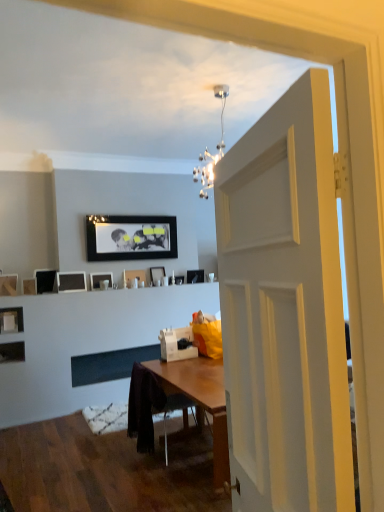
Describe the element at coordinates (71, 281) in the screenshot. I see `matte black picture frame at center, placed as the seventh picture frame when sorted from right to left` at that location.

What do you see at coordinates (134, 276) in the screenshot?
I see `matte black picture frame at upper center, placed as the fourth picture frame when sorted from right to left` at bounding box center [134, 276].

Identify the location of matte black picture frame at upper center, placed as the fourth picture frame when sorted from right to left. This screenshot has height=512, width=384. (134, 276).

The image size is (384, 512). What do you see at coordinates (100, 280) in the screenshot?
I see `matte black picture frame at upper center, the sixth picture frame positioned from the left` at bounding box center [100, 280].

How much space does matte black picture frame at upper center, placed as the eleventh picture frame when sorted from left to right, occupy horizontally?

matte black picture frame at upper center, placed as the eleventh picture frame when sorted from left to right, is 6.08 inches wide.

Where is `matte black picture frame at center, the tenth picture frame viewed from the left`? This screenshot has width=384, height=512. matte black picture frame at center, the tenth picture frame viewed from the left is located at coordinates (179, 279).

You are a GUI agent. You are given a task and a screenshot of the screen. Output one action in this format:
    pyautogui.click(x=<x>, y=<y>)
    Task: Click on the matte black picture frame at left, which is the 1th picture frame in left-to-right order
    
    Given the screenshot: What is the action you would take?
    pyautogui.click(x=8, y=285)

Does black glossy picture frame at upper center, which ranks as the 7th picture frame in left-to-right order, have a greater width compared to matte black picture frame at upper center, the sixth picture frame positioned from the left?

No, black glossy picture frame at upper center, which ranks as the 7th picture frame in left-to-right order, is not wider than matte black picture frame at upper center, the sixth picture frame positioned from the left.

How much distance is there between black glossy picture frame at upper center, which ranks as the 7th picture frame in left-to-right order, and matte black picture frame at upper center, the sixth picture frame positioned from the left?

black glossy picture frame at upper center, which ranks as the 7th picture frame in left-to-right order, and matte black picture frame at upper center, the sixth picture frame positioned from the left, are 27.09 inches apart from each other.

Is point (108, 238) more distant than point (111, 283)?

Yes, it is behind point (111, 283).

The image size is (384, 512). There is a matte black picture frame at upper center, marked as the 6th picture frame in a right-to-left arrangement. Identify the location of the 6th picture frame above it (from a real-world perspective). (130, 237).

Who is shorter, matte black picture frame at left, arranged as the fourth picture frame when viewed from the left, or matte black picture frame at left, acting as the tenth picture frame starting from the right?

matte black picture frame at left, acting as the tenth picture frame starting from the right.

Is point (37, 287) positioned behind point (20, 319)?

Yes, it is.

Is matte black picture frame at left, arranged as the fourth picture frame when viewed from the left, directly adjacent to matte black picture frame at left, acting as the tenth picture frame starting from the right?

No.

Which of these two, wooden chair at center or wooden picture frame at left, the 3th picture frame in the left-to-right sequence, is bigger?

Bigger between the two is wooden chair at center.

Can you confirm if wooden chair at center is positioned to the left of wooden picture frame at left, which is counted as the 9th picture frame, starting from the right?

Incorrect, wooden chair at center is not on the left side of wooden picture frame at left, which is counted as the 9th picture frame, starting from the right.

Is there a large distance between wooden chair at center and wooden picture frame at left, the 3th picture frame in the left-to-right sequence?

wooden chair at center is positioned a significant distance from wooden picture frame at left, the 3th picture frame in the left-to-right sequence.

From the image's perspective, which object appears higher, wooden chair at center or wooden picture frame at left, the 3th picture frame in the left-to-right sequence?

wooden picture frame at left, the 3th picture frame in the left-to-right sequence.

Considering the relative sizes of matte black picture frame at upper center, marked as the 6th picture frame in a right-to-left arrangement, and matte black picture frame at center, the 5th picture frame from the left, in the image provided, is matte black picture frame at upper center, marked as the 6th picture frame in a right-to-left arrangement, shorter than matte black picture frame at center, the 5th picture frame from the left,?

Indeed, matte black picture frame at upper center, marked as the 6th picture frame in a right-to-left arrangement, has a lesser height compared to matte black picture frame at center, the 5th picture frame from the left.

Is matte black picture frame at upper center, marked as the 6th picture frame in a right-to-left arrangement, thinner than matte black picture frame at center, placed as the seventh picture frame when sorted from right to left?

Correct, the width of matte black picture frame at upper center, marked as the 6th picture frame in a right-to-left arrangement, is less than that of matte black picture frame at center, placed as the seventh picture frame when sorted from right to left.

Which is behind, matte black picture frame at upper center, the sixth picture frame positioned from the left, or matte black picture frame at center, the 5th picture frame from the left?

matte black picture frame at upper center, the sixth picture frame positioned from the left, is further from the camera.

Looking at this image, is matte black picture frame at upper center, the sixth picture frame positioned from the left, oriented away from matte black picture frame at center, the 5th picture frame from the left?

No, matte black picture frame at upper center, the sixth picture frame positioned from the left,'s orientation is not away from matte black picture frame at center, the 5th picture frame from the left.

Is matte black picture frame at center, placed as the seventh picture frame when sorted from right to left, oriented towards matte black picture frame at left, acting as the tenth picture frame starting from the right?

No, matte black picture frame at center, placed as the seventh picture frame when sorted from right to left, does not turn towards matte black picture frame at left, acting as the tenth picture frame starting from the right.

Between matte black picture frame at center, placed as the seventh picture frame when sorted from right to left, and matte black picture frame at left, acting as the tenth picture frame starting from the right, which one has less height?

With less height is matte black picture frame at left, acting as the tenth picture frame starting from the right.

Is matte black picture frame at center, the 5th picture frame from the left, spatially inside matte black picture frame at left, which is the second picture frame in left-to-right order, or outside of it?

matte black picture frame at center, the 5th picture frame from the left, is not enclosed by matte black picture frame at left, which is the second picture frame in left-to-right order.

In the image, is matte black picture frame at center, the 5th picture frame from the left, on the left side or the right side of matte black picture frame at left, which is the second picture frame in left-to-right order?

In the image, matte black picture frame at center, the 5th picture frame from the left, appears on the right side of matte black picture frame at left, which is the second picture frame in left-to-right order.

Is matte black picture frame at center, placed as the seventh picture frame when sorted from right to left, positioned before wooden chair at center?

No, the depth of matte black picture frame at center, placed as the seventh picture frame when sorted from right to left, is greater than that of wooden chair at center.

Which point is more forward, [85,285] or [141,403]?

The point [141,403] is closer to the camera.

Does matte black picture frame at center, the 5th picture frame from the left, appear on the left side of wooden chair at center?

Indeed, matte black picture frame at center, the 5th picture frame from the left, is positioned on the left side of wooden chair at center.

Is matte black picture frame at upper center, placed as the fourth picture frame when sorted from right to left, in front of or behind matte black picture frame at center, the 9th picture frame from the left, in the image?

matte black picture frame at upper center, placed as the fourth picture frame when sorted from right to left, is in front of matte black picture frame at center, the 9th picture frame from the left.

Considering the sizes of matte black picture frame at upper center, the 8th picture frame when ordered from left to right, and matte black picture frame at center, the 3th picture frame from the right, in the image, is matte black picture frame at upper center, the 8th picture frame when ordered from left to right, taller or shorter than matte black picture frame at center, the 3th picture frame from the right,?

Clearly, matte black picture frame at upper center, the 8th picture frame when ordered from left to right, is shorter compared to matte black picture frame at center, the 3th picture frame from the right.

Would you say matte black picture frame at upper center, the 8th picture frame when ordered from left to right, is outside matte black picture frame at center, the 3th picture frame from the right?

matte black picture frame at upper center, the 8th picture frame when ordered from left to right, is positioned outside matte black picture frame at center, the 3th picture frame from the right.

Between point (139, 279) and point (159, 278), which one is positioned behind?

Positioned behind is point (159, 278).

From the image's perspective, which picture frame is the 6th one below the black glossy picture frame at upper center, arranged as the fifth picture frame when viewed from the right? Please provide its 2D coordinates.

[(100, 280)]

There is a matte black picture frame at left, arranged as the fourth picture frame when viewed from the left. Where is `the 9th picture frame below it (from a real-world perspective)`? the 9th picture frame below it (from a real-world perspective) is located at coordinates (11, 320).

Based on their spatial positions, is matte black picture frame at center, the 3th picture frame from the right, or wooden chair at center closer to matte black picture frame at left, arranged as the fourth picture frame when viewed from the left?

Based on the image, matte black picture frame at center, the 3th picture frame from the right, appears to be nearer to matte black picture frame at left, arranged as the fourth picture frame when viewed from the left.

Based on their spatial positions, is matte black picture frame at center, the 3th picture frame from the right, or matte black picture frame at upper center, the sixth picture frame positioned from the left, further from black glossy picture frame at upper center, which ranks as the 7th picture frame in left-to-right order?

The object further to black glossy picture frame at upper center, which ranks as the 7th picture frame in left-to-right order, is matte black picture frame at upper center, the sixth picture frame positioned from the left.

Which object lies further to the anchor point wooden picture frame at left, which is counted as the 9th picture frame, starting from the right, matte black picture frame at upper center, the 8th picture frame when ordered from left to right, or matte black picture frame at left, acting as the tenth picture frame starting from the right?

matte black picture frame at upper center, the 8th picture frame when ordered from left to right, is positioned further to the anchor wooden picture frame at left, which is counted as the 9th picture frame, starting from the right.

When comparing their distances from matte black picture frame at upper center, placed as the eleventh picture frame when sorted from left to right, does wooden picture frame at left, which is counted as the 9th picture frame, starting from the right, or matte black picture frame at left, arranged as the fourth picture frame when viewed from the left, seem closer?

Based on the image, matte black picture frame at left, arranged as the fourth picture frame when viewed from the left, appears to be nearer to matte black picture frame at upper center, placed as the eleventh picture frame when sorted from left to right.

Based on their spatial positions, is black glossy picture frame at upper center, arranged as the fifth picture frame when viewed from the right, or matte black picture frame at left, arranged as the fourth picture frame when viewed from the left, further from matte black picture frame at center, the 3th picture frame from the right?

matte black picture frame at left, arranged as the fourth picture frame when viewed from the left.

Looking at this image, based on their spatial positions, is wooden chair at center or black glossy picture frame at upper center, arranged as the fifth picture frame when viewed from the right, further from matte black picture frame at center, the 9th picture frame from the left?

Among the two, wooden chair at center is located further to matte black picture frame at center, the 9th picture frame from the left.

Which object lies nearer to the anchor point matte black picture frame at center, which is the second picture frame in right-to-left order, wooden chair at center or matte black picture frame at center, placed as the seventh picture frame when sorted from right to left?

The object closer to matte black picture frame at center, which is the second picture frame in right-to-left order, is matte black picture frame at center, placed as the seventh picture frame when sorted from right to left.

From the image, which object appears to be farther from matte black picture frame at left, marked as the 8th picture frame in a right-to-left arrangement, matte black picture frame at center, the 9th picture frame from the left, or matte black picture frame at upper center, placed as the fourth picture frame when sorted from right to left?

Among the two, matte black picture frame at center, the 9th picture frame from the left, is located further to matte black picture frame at left, marked as the 8th picture frame in a right-to-left arrangement.

This screenshot has width=384, height=512. Identify the location of chair situated between matte black picture frame at left, which ranks as the eleventh picture frame in right-to-left order, and matte black picture frame at upper center, which is counted as the first picture frame, starting from the right, from left to right. (150, 407).

I want to click on picture frame between matte black picture frame at left, arranged as the fourth picture frame when viewed from the left, and matte black picture frame at upper center, marked as the 6th picture frame in a right-to-left arrangement, from left to right, so click(x=71, y=281).

Where is `picture frame situated between wooden picture frame at left, the 3th picture frame in the left-to-right sequence, and matte black picture frame at center, the 5th picture frame from the left, from left to right`? Image resolution: width=384 pixels, height=512 pixels. picture frame situated between wooden picture frame at left, the 3th picture frame in the left-to-right sequence, and matte black picture frame at center, the 5th picture frame from the left, from left to right is located at coordinates (45, 280).

Locate an element on the screen. The image size is (384, 512). picture frame between matte black picture frame at left, which is the 1th picture frame in left-to-right order, and matte black picture frame at left, acting as the tenth picture frame starting from the right, in the vertical direction is located at coordinates (30, 286).